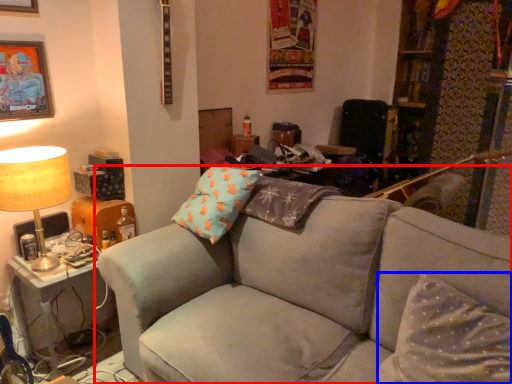
Question: Which object appears farthest to the camera in this image, studio couch (highlighted by a red box) or pillow (highlighted by a blue box)?

Choices:
 (A) studio couch
 (B) pillow

Answer: (B)